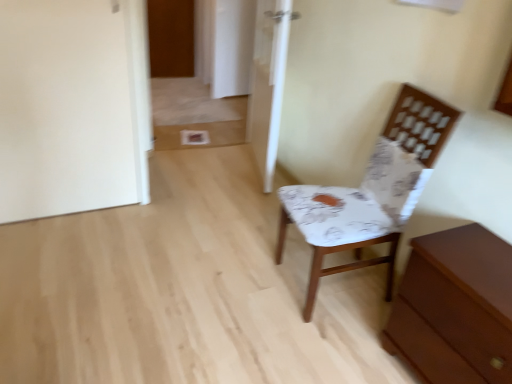
Where is `free spot above brown wooden chest of drawers at lower right (from a real-world perspective)`? The width and height of the screenshot is (512, 384). free spot above brown wooden chest of drawers at lower right (from a real-world perspective) is located at coordinates (479, 256).